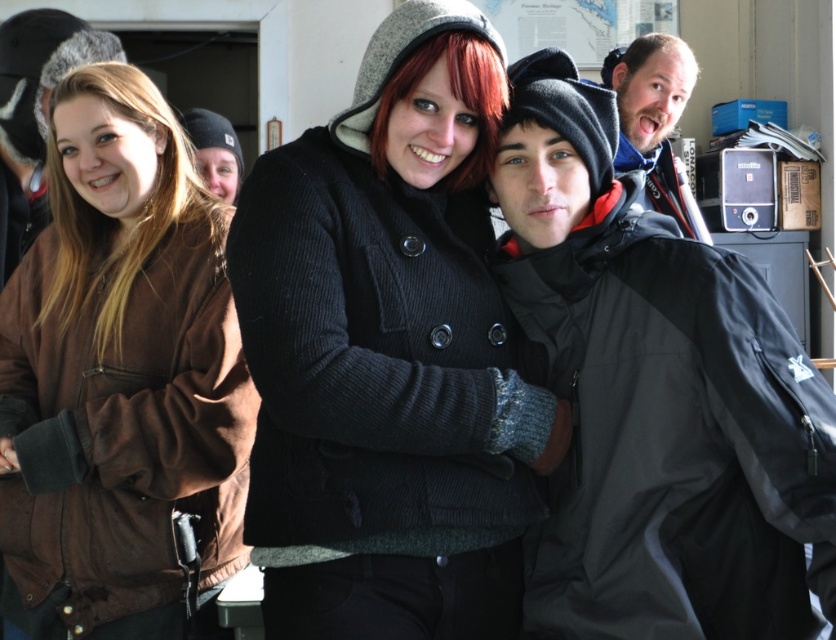
Looking at this image, who is shorter, matte black coat at center or matte black jacket at center?

matte black jacket at center is shorter.

Is point (340, 445) positioned before point (743, 499)?

No, it is behind (743, 499).

At what (x,y) coordinates should I click in order to perform the action: click on matte black coat at center. Please return your answer as a coordinate pair (x, y). The height and width of the screenshot is (640, 836). Looking at the image, I should click on (388, 355).

Does brown suede jacket at left have a smaller size compared to bearded man at upper right?

Incorrect, brown suede jacket at left is not smaller in size than bearded man at upper right.

Is brown suede jacket at left to the right of bearded man at upper right from the viewer's perspective?

In fact, brown suede jacket at left is to the left of bearded man at upper right.

Image resolution: width=836 pixels, height=640 pixels. I want to click on brown suede jacket at left, so pos(121,378).

The image size is (836, 640). What do you see at coordinates (654, 396) in the screenshot? I see `matte black jacket at center` at bounding box center [654, 396].

Is matte black jacket at center shorter than brown suede jacket at left?

Yes.

This screenshot has width=836, height=640. What do you see at coordinates (654, 396) in the screenshot?
I see `matte black jacket at center` at bounding box center [654, 396].

Identify the location of matte black jacket at center. (654, 396).